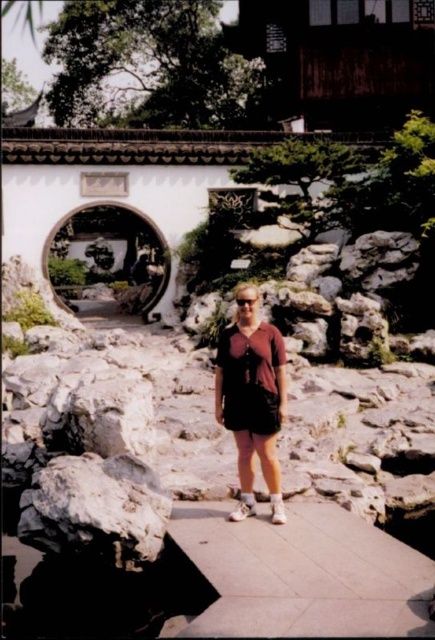
Question: Estimate the real-world distances between objects in this image. Which object is farther from the smooth concrete path at center?

Choices:
 (A) dark gray rough rock at center
 (B) matte brown shorts at center

Answer: (B)

Question: Is smooth concrete path at center above matte brown shorts at center?

Choices:
 (A) no
 (B) yes

Answer: (A)

Question: Which object appears closest to the camera in this image?

Choices:
 (A) smooth concrete path at center
 (B) matte brown shorts at center

Answer: (A)

Question: Can you confirm if smooth concrete path at center is wider than matte brown shorts at center?

Choices:
 (A) no
 (B) yes

Answer: (B)

Question: Is the position of smooth concrete path at center less distant than that of dark gray rough rock at center?

Choices:
 (A) yes
 (B) no

Answer: (A)

Question: Estimate the real-world distances between objects in this image. Which object is closer to the dark gray rough rock at center?

Choices:
 (A) smooth concrete path at center
 (B) matte brown shorts at center

Answer: (A)